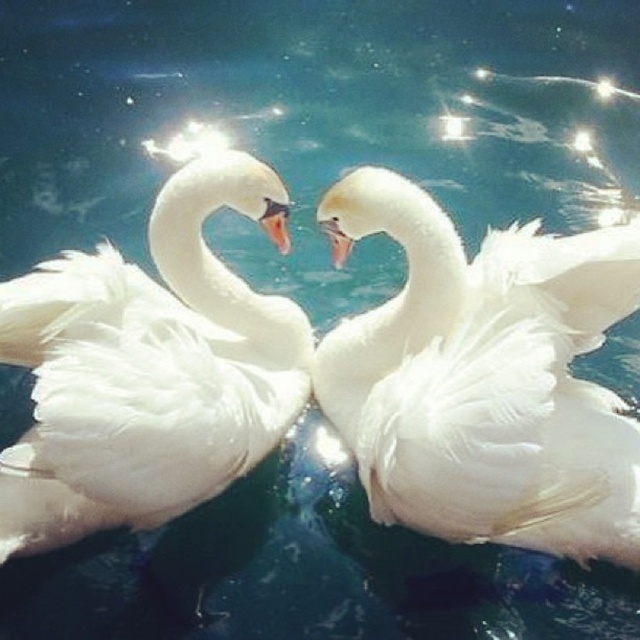
You are observing two points in the image. According to their positions, which point is closer to the viewer? The points are point (593, 417) and point (99, 403).

Point (99, 403) is closer to the viewer because it is in front of point (593, 417).

You are a photographer trying to capture the heart shape formed by the two white fluffy swans. Your camera can only focus on objects within a 15 inch range. Can you focus on both the white fluffy swan at center and the white fluffy swan at left simultaneously?

The white fluffy swan at center is 17.46 inches away from the white fluffy swan at left. Since the distance between them exceeds the camera focus range of 15 inches, you cannot focus on both simultaneously.

You are a photographer aiming to capture the two white fluffy swan at center and white fluffy swan at left in a way that highlights their size difference. Which swan should you focus on to emphasize its larger size?

The white fluffy swan at center is taller than the white fluffy swan at left, so focusing on the white fluffy swan at center will emphasize its larger size.